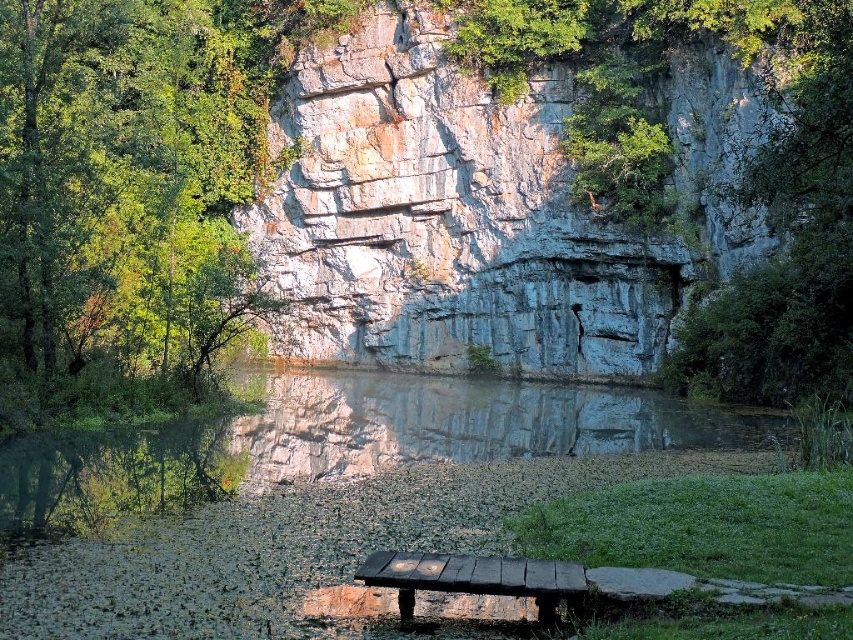
Question: Which point is farther to the camera?

Choices:
 (A) (486, 566)
 (B) (28, 259)

Answer: (B)

Question: Does green leafy tree at upper left appear on the right side of charcoal wood bench at lower center?

Choices:
 (A) no
 (B) yes

Answer: (A)

Question: Does green leafy tree at upper left appear on the left side of charcoal wood bench at lower center?

Choices:
 (A) yes
 (B) no

Answer: (A)

Question: Which point appears farthest from the camera in this image?

Choices:
 (A) (402, 563)
 (B) (106, 145)

Answer: (B)

Question: From the image, what is the correct spatial relationship of green leafy tree at upper left in relation to charcoal wood bench at lower center?

Choices:
 (A) below
 (B) above

Answer: (B)